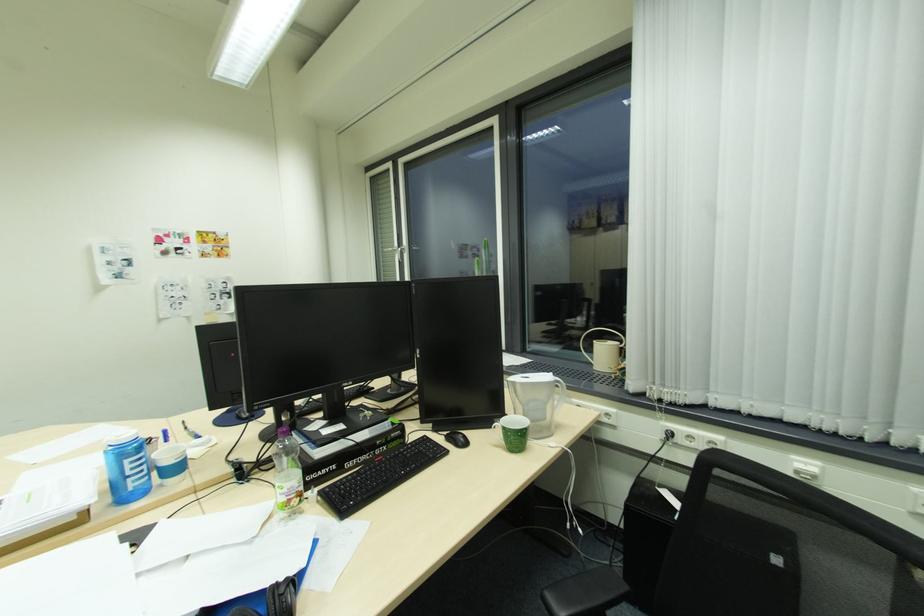
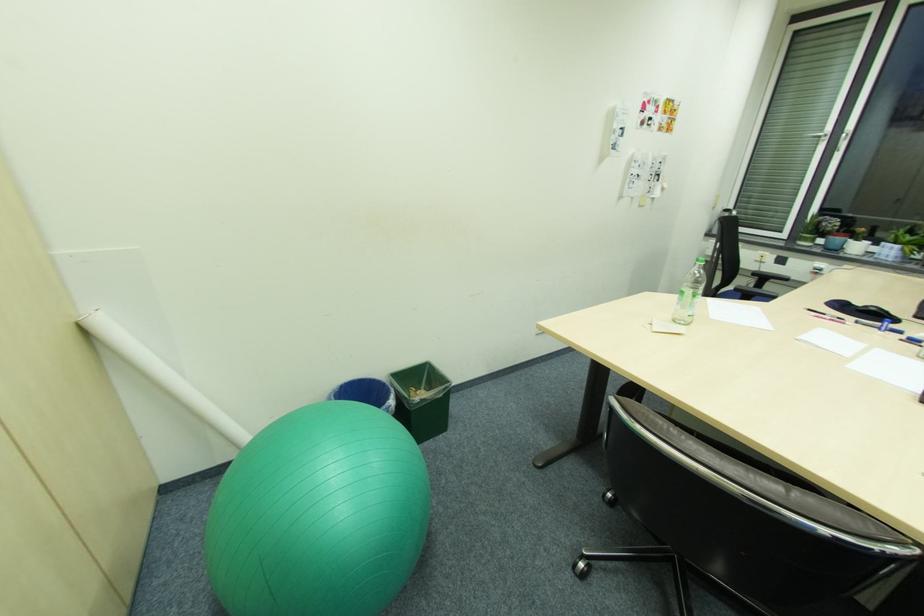
Question: In a continuous first-person perspective shot, in which direction is the camera moving?

Choices:
 (A) Left
 (B) Right
 (C) Forward
 (D) Backward

Answer: (A)